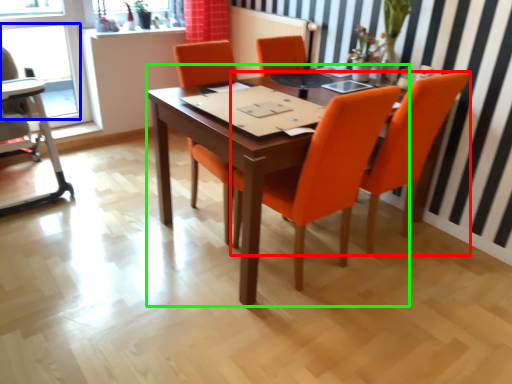
Question: Based on their relative distances, which object is nearer to chair (highlighted by a red box)? Choose from window (highlighted by a blue box) and table (highlighted by a green box).

Choices:
 (A) window
 (B) table

Answer: (B)